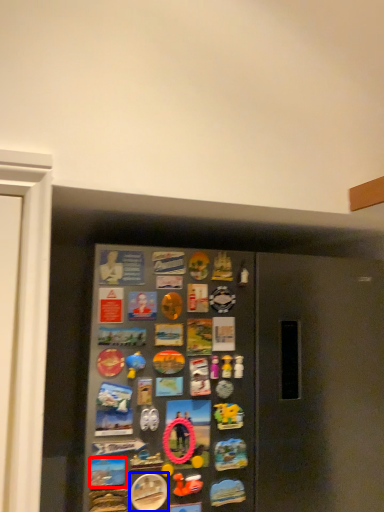
Question: Among these objects, which one is farthest to the camera, button (highlighted by a red box) or button (highlighted by a blue box)?

Choices:
 (A) button
 (B) button

Answer: (B)